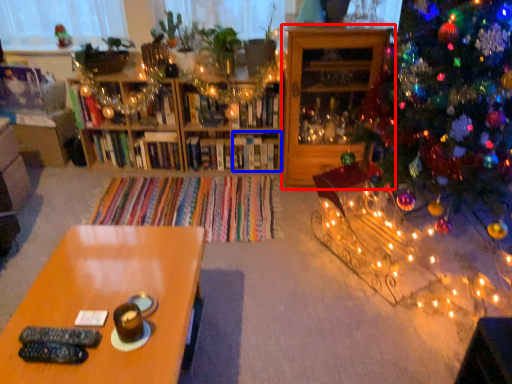
Question: Among these objects, which one is farthest to the camera, shelf (highlighted by a red box) or shelf (highlighted by a blue box)?

Choices:
 (A) shelf
 (B) shelf

Answer: (B)